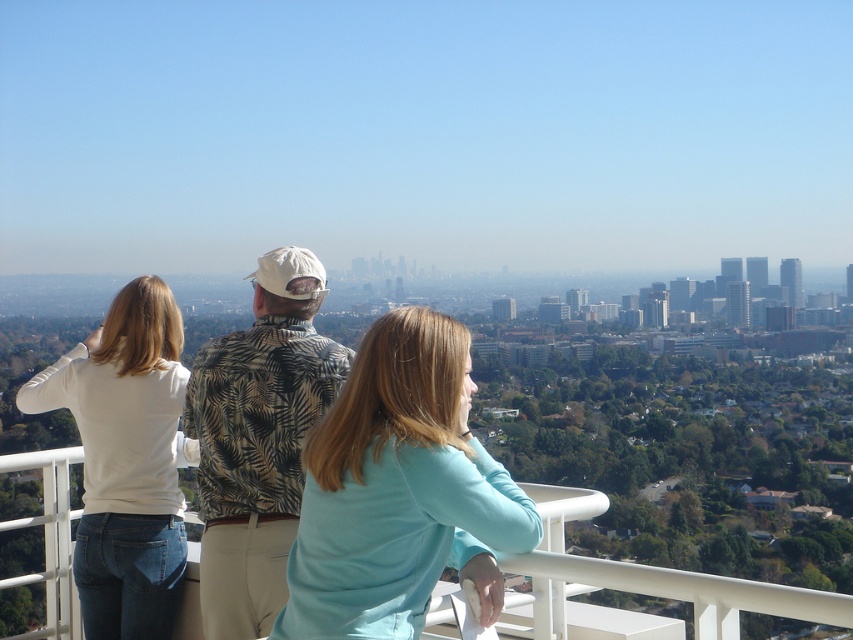
Where is `light blue fabric at center`? This screenshot has width=853, height=640. light blue fabric at center is located at coordinates [x=398, y=490].

Is light blue fabric at center further to camera compared to printed fabric shirt at center?

No, it is not.

Is point (425, 488) closer to viewer compared to point (296, 353)?

That is True.

You are a GUI agent. You are given a task and a screenshot of the screen. Output one action in this format:
    pyautogui.click(x=<x>, y=<y>)
    Task: Click on the light blue fabric at center
    The image size is (853, 640).
    Given the screenshot: What is the action you would take?
    pyautogui.click(x=398, y=490)

From the picture: Which of these two, light blue fabric at center or white cotton shirt at center, stands taller?

Standing taller between the two is white cotton shirt at center.

Which is behind, point (316, 602) or point (244, 342)?

The point (244, 342) is behind.

Locate an element on the screen. light blue fabric at center is located at coordinates (398, 490).

Who is positioned more to the right, white cotton shirt at center or white matte shirt at left?

white cotton shirt at center

Between white cotton shirt at center and white matte shirt at left, which one appears on the left side from the viewer's perspective?

white matte shirt at left is more to the left.

Locate an element on the screen. This screenshot has width=853, height=640. white cotton shirt at center is located at coordinates (259, 436).

What are the coordinates of `white cotton shirt at center` in the screenshot? It's located at (259, 436).